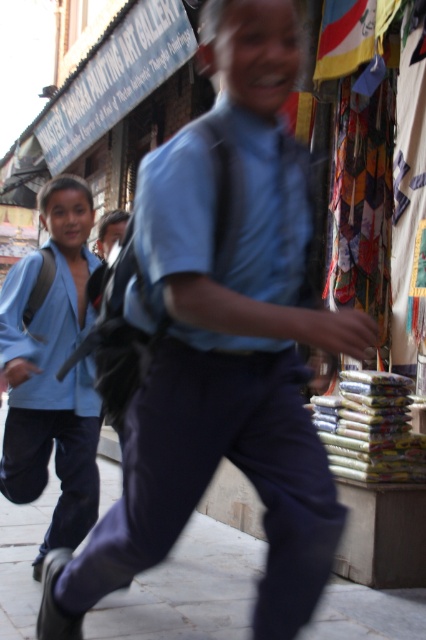
You are a photographer standing at the edge of the street. You want to capture a photo of the blue cotton shirt at center and the gray concrete pavement at lower center. Which object is positioned to the right side in the image?

The blue cotton shirt at center is to the right of the gray concrete pavement at lower center.

You are standing on the gray concrete pavement at lower center and want to throw a small ball to someone standing near the light blue fabric jacket at left. Will the ball roll towards the jacket or away from it based on the slope of the pavement?

The gray concrete pavement at lower center is closer to the viewer than the light blue fabric jacket at left, so the ball will roll away from the jacket towards the viewer.